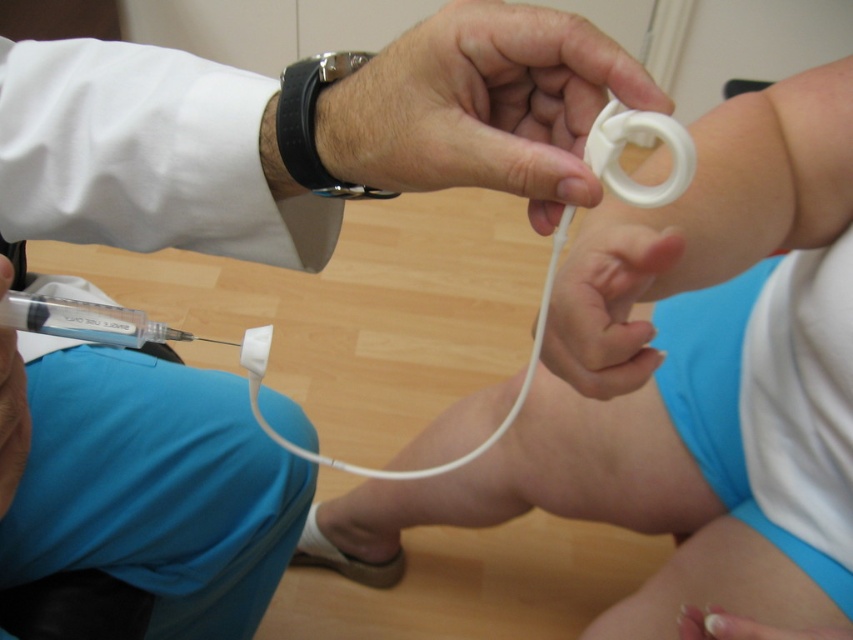
Is transparent plastic syringe at lower left smaller than white matte fingernail at lower center?

Incorrect, transparent plastic syringe at lower left is not smaller in size than white matte fingernail at lower center.

Which is more to the left, transparent plastic syringe at lower left or white matte fingernail at lower center?

transparent plastic syringe at lower left is more to the left.

This screenshot has width=853, height=640. I want to click on transparent plastic syringe at lower left, so click(86, 321).

Looking at this image, which is more to the left, white matte cord at lower center or transparent plastic syringe at lower left?

Positioned to the left is transparent plastic syringe at lower left.

Consider the image. Does white matte cord at lower center appear under transparent plastic syringe at lower left?

No, white matte cord at lower center is not below transparent plastic syringe at lower left.

Is point (554, 340) closer to camera compared to point (9, 316)?

No, (554, 340) is behind (9, 316).

Identify the location of white matte cord at lower center. This screenshot has height=640, width=853. (614, 296).

Based on the photo, can you confirm if white matte ring at upper center is smaller than white matte cord at lower center?

Indeed, white matte ring at upper center has a smaller size compared to white matte cord at lower center.

How far apart are white matte ring at upper center and white matte cord at lower center?

white matte ring at upper center and white matte cord at lower center are 4.19 inches apart from each other.

Is point (506, 160) closer to viewer compared to point (631, 218)?

Yes, point (506, 160) is closer to viewer.

Locate an element on the screen. The height and width of the screenshot is (640, 853). white matte ring at upper center is located at coordinates (482, 106).